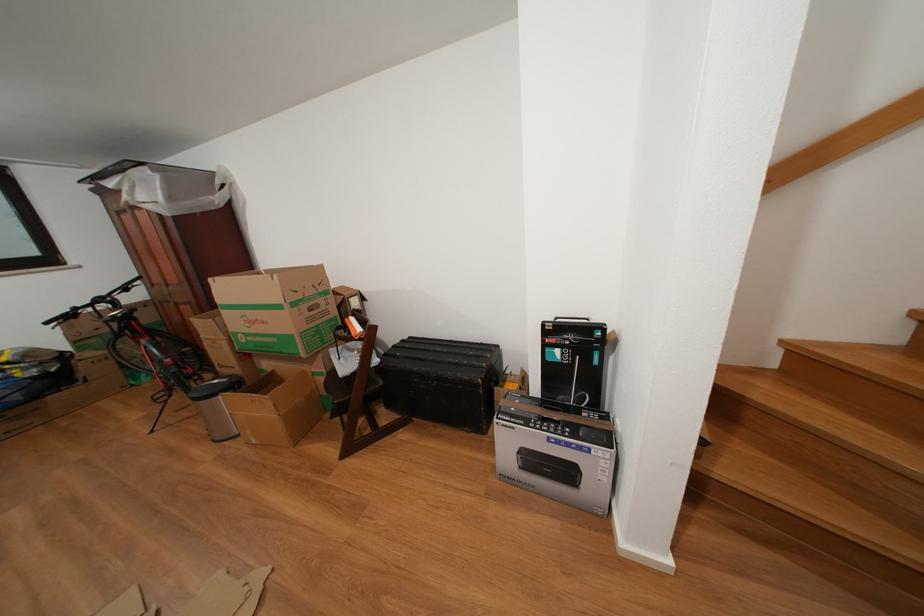
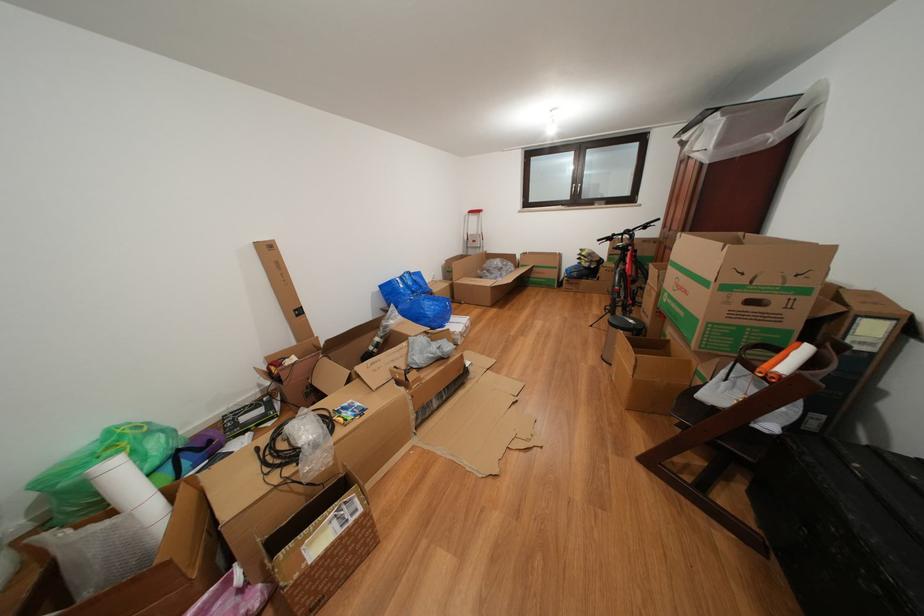
Locate, in the second image, the point that corresponds to pixel 353 331 in the first image.

(784, 355)